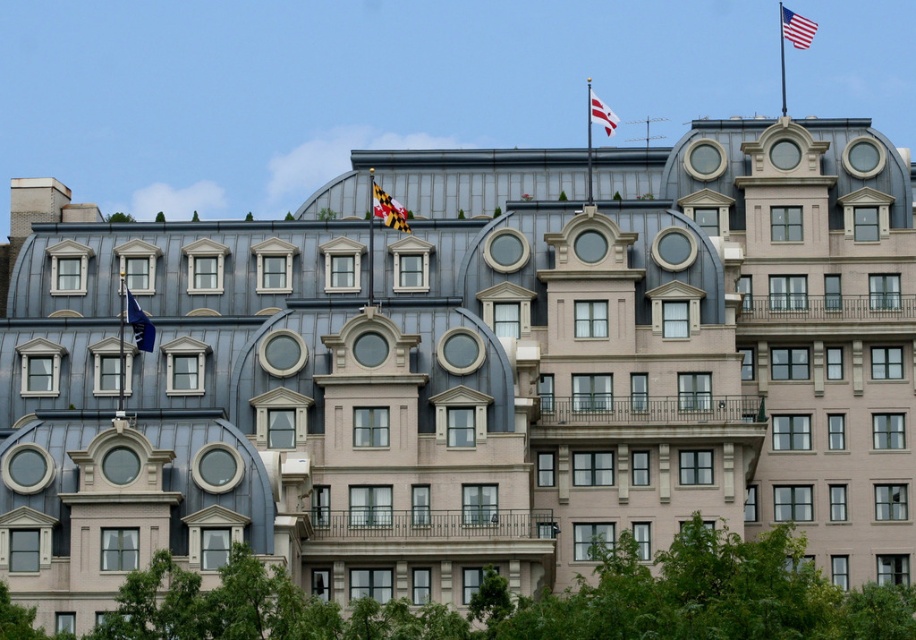
You are standing in front of a building and see the maryland state flag at center and the american flag at upper right. Which flag is located more to the left?

The maryland state flag at center is more to the left than the american flag at upper right.

Based on the photo, you are a visitor standing in front of the building and notice two flags. The Maryland state flag at center and the white fabric flag at upper center. Which flag is higher up on the building?

The white fabric flag at upper center is higher up on the building because the Maryland state flag at center is positioned under it.

You are standing in front of the building and notice the Maryland state flag at center. If you were to walk directly towards the flag, which direction relative to your current position would you need to move?

The Maryland state flag at center is located at point coordinates, so you would need to move forward directly towards the center of the building to reach it since it is centrally positioned.